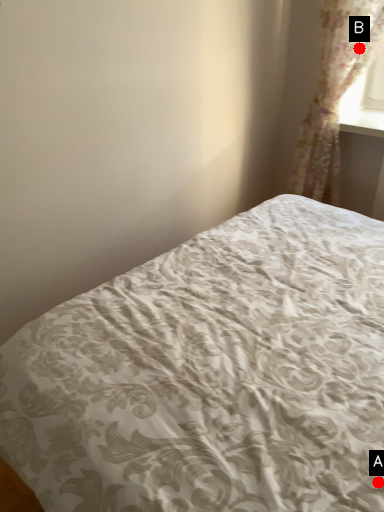
Question: Two points are circled on the image, labeled by A and B beside each circle. Which point appears closest to the camera in this image?

Choices:
 (A) A is closer
 (B) B is closer

Answer: (A)